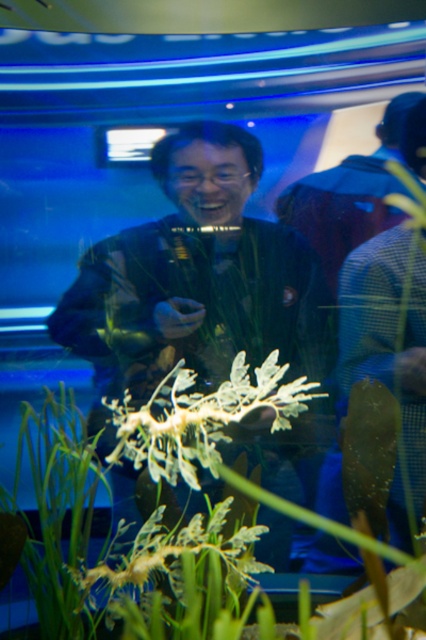
Is white leafy plant at center in front of white leafy structure at center?

Yes, it is in front of white leafy structure at center.

What do you see at coordinates (149, 577) in the screenshot?
I see `white leafy plant at center` at bounding box center [149, 577].

Is point (166, 621) farther from camera compared to point (215, 451)?

No, it is not.

Where is `white leafy plant at center`? white leafy plant at center is located at coordinates (149, 577).